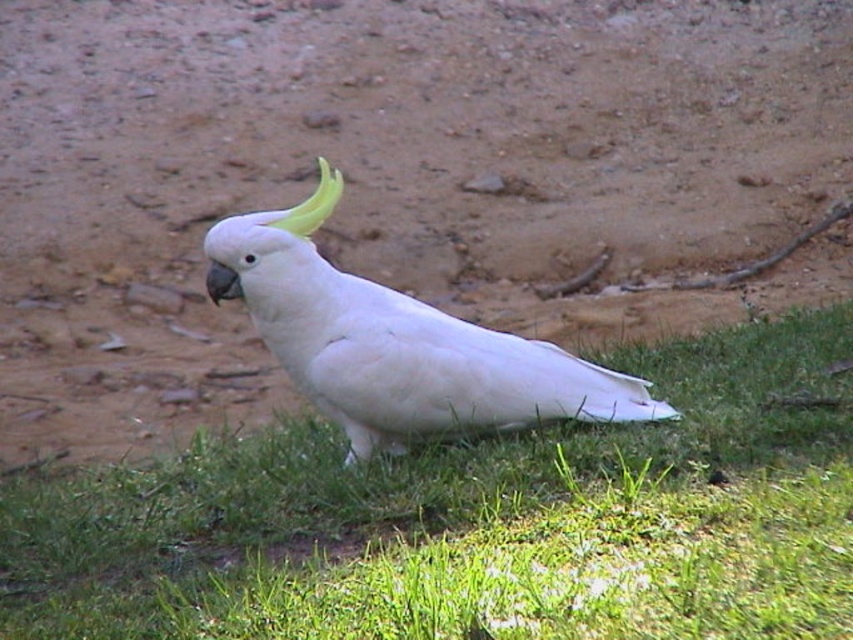
Between point (437, 472) and point (380, 358), which one is positioned in front?

Point (380, 358)

Does green grass at lower center lie in front of white feathered parrot at center?

Yes, green grass at lower center is in front of white feathered parrot at center.

The height and width of the screenshot is (640, 853). What are the coordinates of `green grass at lower center` in the screenshot? It's located at (474, 520).

The width and height of the screenshot is (853, 640). Identify the location of green grass at lower center. (474, 520).

Between point (822, 205) and point (758, 472), which one is positioned behind?

The point (822, 205) is behind.

Is brown soil at center closer to camera compared to green grass at lower center?

No, brown soil at center is behind green grass at lower center.

Locate an element on the screen. This screenshot has height=640, width=853. brown soil at center is located at coordinates (393, 179).

Is brown soil at center to the right of white feathered parrot at center from the viewer's perspective?

Indeed, brown soil at center is positioned on the right side of white feathered parrot at center.

Does point (183, 28) lie in front of point (508, 342)?

No, it is behind (508, 342).

Which is in front, point (612, 113) or point (312, 259)?

Positioned in front is point (312, 259).

The image size is (853, 640). Find the location of `brown soil at center`. brown soil at center is located at coordinates (393, 179).